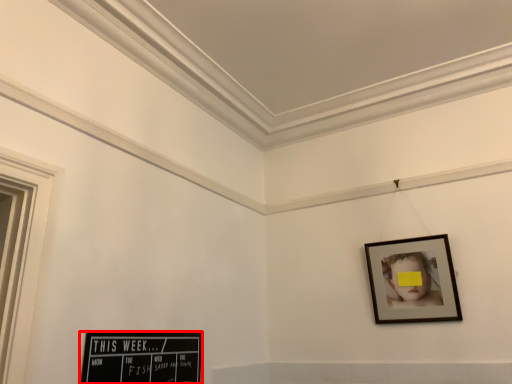
Question: Where is picture frame (annotated by the red box) located in relation to picture frame in the image?

Choices:
 (A) right
 (B) left

Answer: (B)